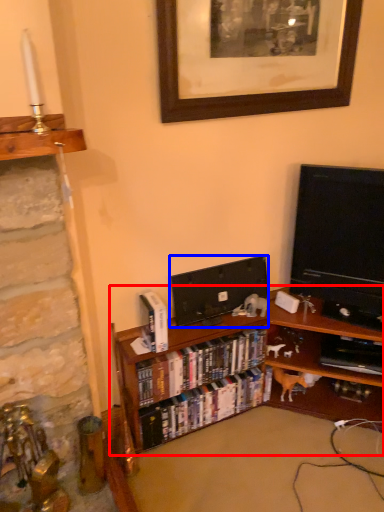
Question: Which object is further to the camera taking this photo, bookcase (highlighted by a red box) or television (highlighted by a blue box)?

Choices:
 (A) bookcase
 (B) television

Answer: (B)